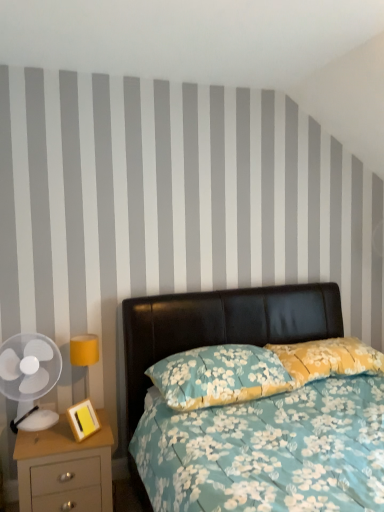
What are the coordinates of `free space in front of matte yellow lampshade at left` in the screenshot? It's located at (65, 431).